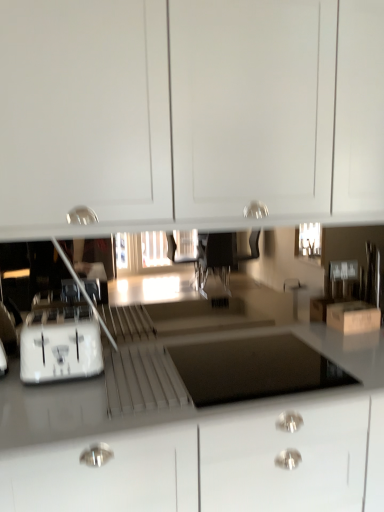
Question: Is white plastic drawer at center in contact with white glossy countertop at lower center?

Choices:
 (A) no
 (B) yes

Answer: (B)

Question: Would you say white plastic drawer at center is outside white glossy countertop at lower center?

Choices:
 (A) no
 (B) yes

Answer: (A)

Question: Is white plastic drawer at center oriented towards white glossy countertop at lower center?

Choices:
 (A) yes
 (B) no

Answer: (A)

Question: Can white glossy countertop at lower center be found inside white plastic drawer at center?

Choices:
 (A) no
 (B) yes

Answer: (A)

Question: Is white plastic drawer at center to the left of white glossy countertop at lower center from the viewer's perspective?

Choices:
 (A) yes
 (B) no

Answer: (A)

Question: Is white plastic drawer at center positioned with its back to white glossy countertop at lower center?

Choices:
 (A) no
 (B) yes

Answer: (B)

Question: Considering the relative positions of white glossy cabinet at upper center and white glossy countertop at lower center in the image provided, is white glossy cabinet at upper center behind white glossy countertop at lower center?

Choices:
 (A) yes
 (B) no

Answer: (A)

Question: Can you confirm if white glossy cabinet at upper center is shorter than white glossy countertop at lower center?

Choices:
 (A) no
 (B) yes

Answer: (B)

Question: Are white glossy cabinet at upper center and white glossy countertop at lower center beside each other?

Choices:
 (A) yes
 (B) no

Answer: (B)

Question: Does white glossy cabinet at upper center have a greater height compared to white glossy countertop at lower center?

Choices:
 (A) no
 (B) yes

Answer: (A)

Question: Does white glossy cabinet at upper center have a smaller size compared to white glossy countertop at lower center?

Choices:
 (A) no
 (B) yes

Answer: (B)

Question: Does white glossy cabinet at upper center contain white glossy countertop at lower center?

Choices:
 (A) no
 (B) yes

Answer: (A)

Question: From a real-world perspective, is brown cardboard box at lower right positioned over white plastic drawer at center based on gravity?

Choices:
 (A) yes
 (B) no

Answer: (A)